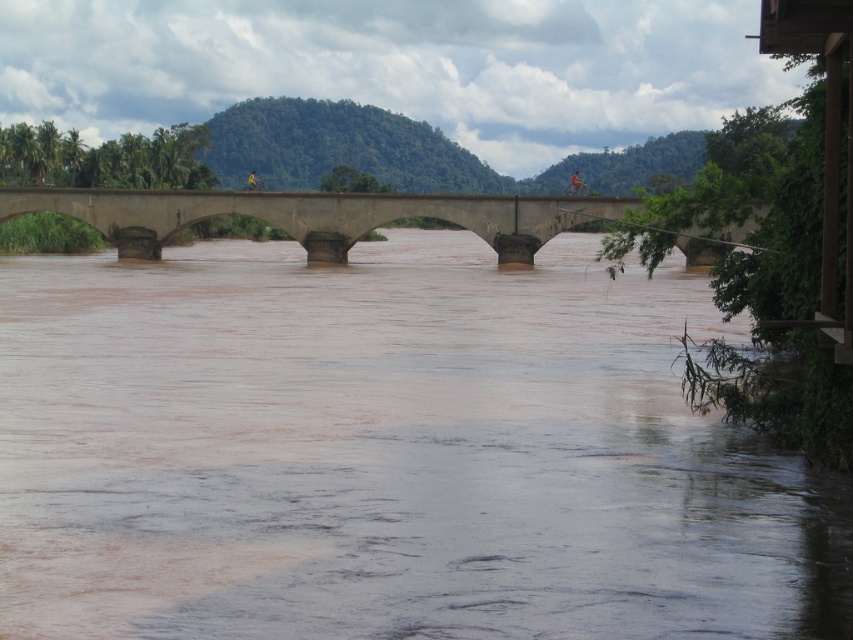
You are a photographer planning to capture the entire scene of the brown muddy water at center and the concrete bridge at center. Given their sizes, which one will occupy more space in your photo?

The brown muddy water at center is larger in size than the concrete bridge at center, so it will occupy more space in the photo.

You are standing at point A located at point (426, 506). You need to walk to point B, which is 17.46 meters away. Given the scene described, is there any obstacle between you and point B that might hinder your path?

The two points are 17.46 meters apart. There are no obstacles mentioned between them in the scene description, so the path should be clear.

You are a cyclist approaching the concrete bridge at center. You notice the brown muddy water at center flowing below. From your perspective on the bridge, which object appears closer to you?

The brown muddy water at center appears closer because it is positioned in front of the concrete bridge at center from the observer perspective.